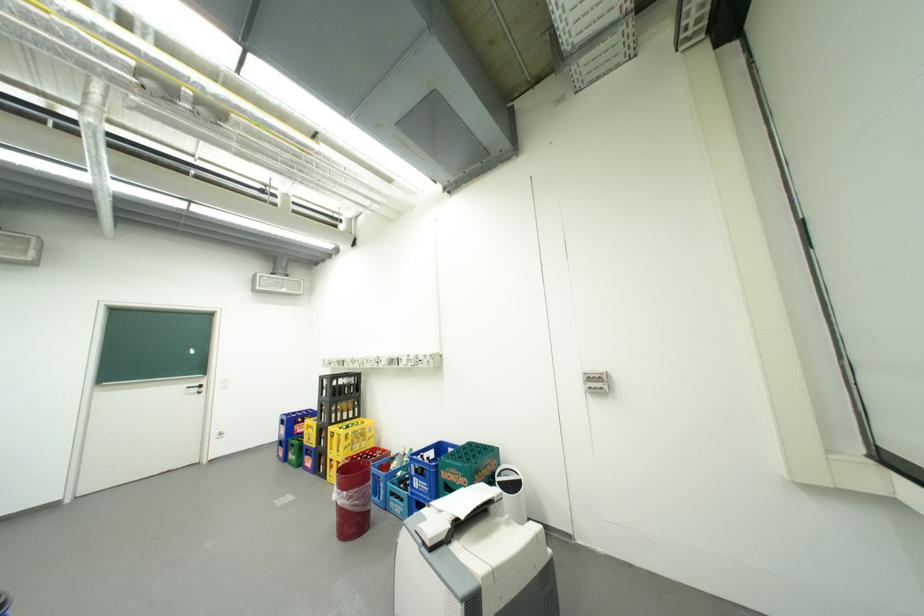
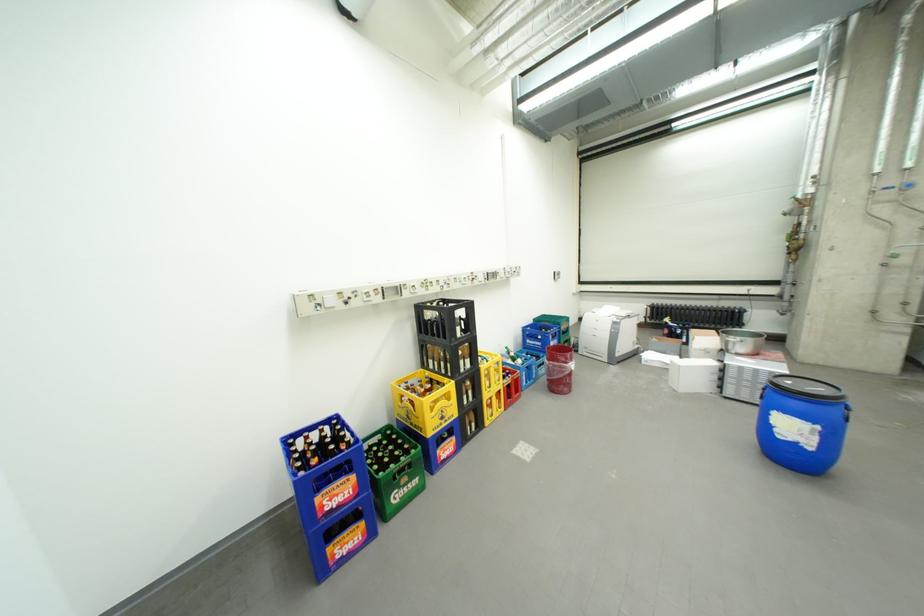
Where in the second image is the point corresponding to point 424,480 from the first image?

(562, 344)